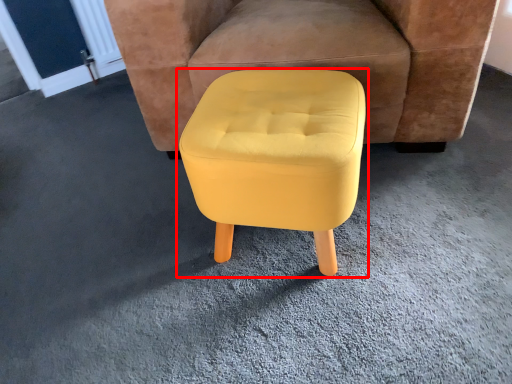
Question: Considering the relative positions of stool (annotated by the red box) and chair in the image provided, where is stool (annotated by the red box) located with respect to the staircase?

Choices:
 (A) left
 (B) right

Answer: (A)